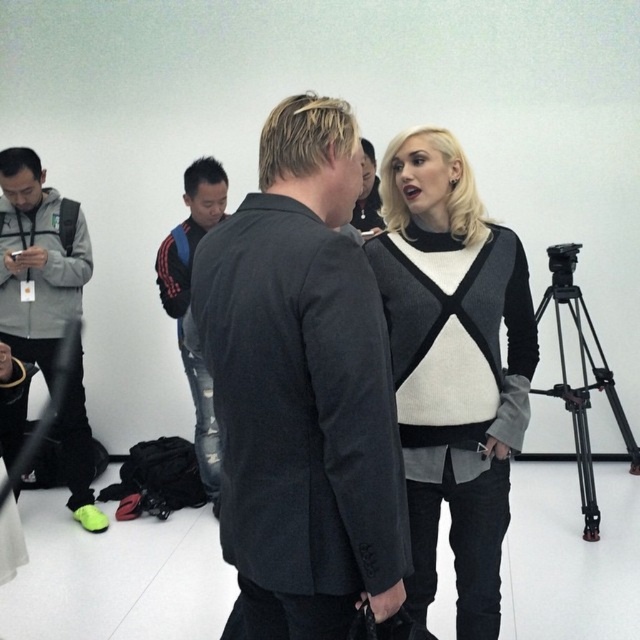
Does gray fleece jacket at left appear under blue/red striped hoodie at center?

Correct, gray fleece jacket at left is located below blue/red striped hoodie at center.

The image size is (640, 640). I want to click on gray fleece jacket at left, so 38,259.

Between dark gray suit at center and black metal tripod at right, which one is positioned lower?

black metal tripod at right is lower down.

Does dark gray suit at center appear under black metal tripod at right?

No, dark gray suit at center is not below black metal tripod at right.

The width and height of the screenshot is (640, 640). Identify the location of dark gray suit at center. (301, 387).

Identify the location of dark gray suit at center. The width and height of the screenshot is (640, 640). (301, 387).

Who is positioned more to the left, blue/red striped hoodie at center or black metal tripod at right?

blue/red striped hoodie at center is more to the left.

Is point (163, 262) farther from viewer compared to point (532, 392)?

Yes, point (163, 262) is behind point (532, 392).

Between point (198, 362) and point (589, 445), which one is positioned in front?

Point (198, 362) is in front.

The width and height of the screenshot is (640, 640). Identify the location of blue/red striped hoodie at center. (188, 301).